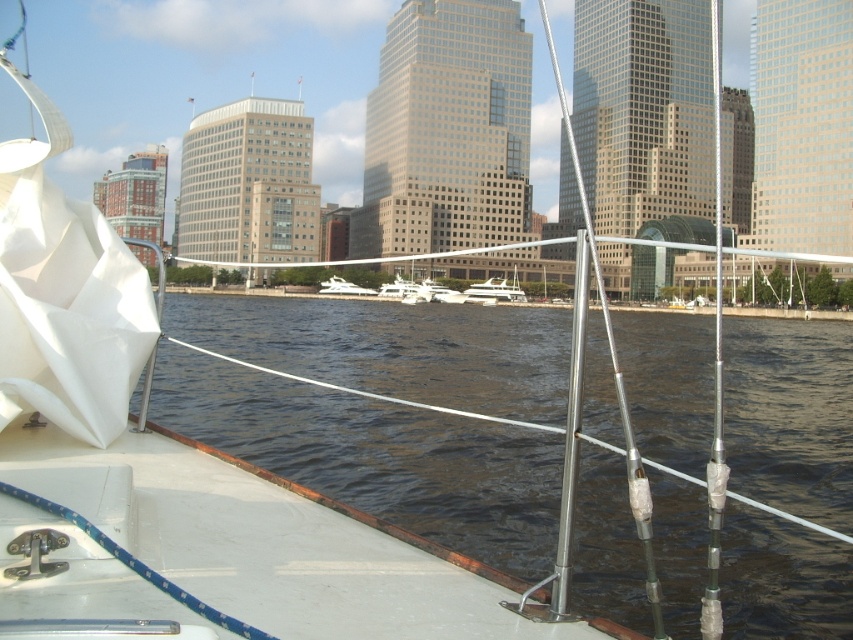
Question: Among these objects, which one is farthest from the camera?

Choices:
 (A) white glossy boat at center
 (B) white glossy yacht at center

Answer: (A)

Question: Does dark blue water at center appear on the left side of white glossy yacht at center?

Choices:
 (A) no
 (B) yes

Answer: (B)

Question: Can you confirm if dark blue water at center is positioned to the left of white glossy boat at center?

Choices:
 (A) no
 (B) yes

Answer: (A)

Question: Which point is closer to the camera?

Choices:
 (A) (421, 456)
 (B) (331, 276)

Answer: (A)

Question: Considering the relative positions of white glossy yacht at center and white glossy boat at center in the image provided, where is white glossy yacht at center located with respect to white glossy boat at center?

Choices:
 (A) above
 (B) below

Answer: (B)

Question: Which point is closer to the camera?

Choices:
 (A) white glossy boat at center
 (B) dark blue water at center
 (C) white glossy yacht at center

Answer: (B)